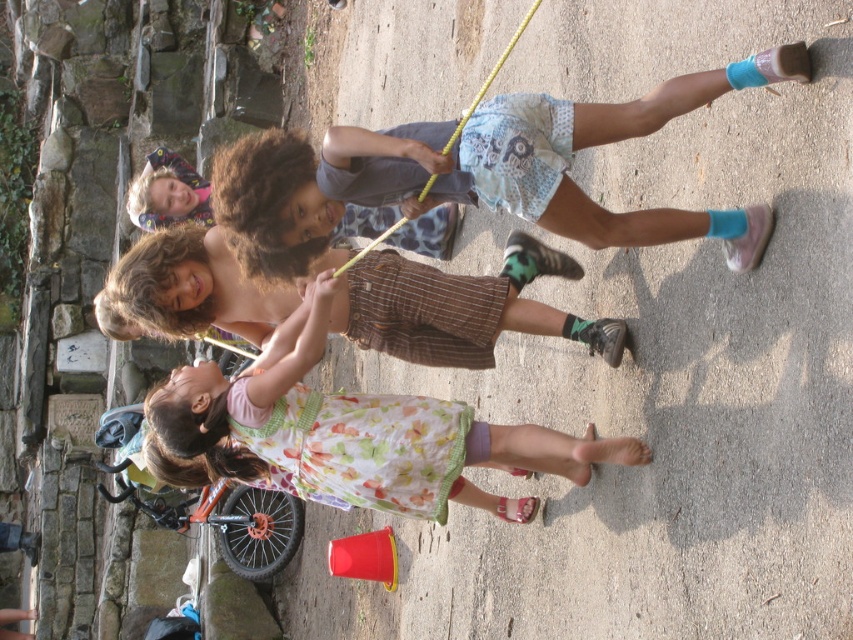
Between brown plaid shorts at center and blonde hair at upper left, which one is positioned lower?

brown plaid shorts at center is lower down.

Which is behind, point (409, 344) or point (149, 173)?

The point (149, 173) is more distant.

Where is `brown plaid shorts at center`? The height and width of the screenshot is (640, 853). brown plaid shorts at center is located at coordinates (462, 308).

Which is more to the right, light blue printed shorts at upper right or yellow rubber rope at center?

From the viewer's perspective, yellow rubber rope at center appears more on the right side.

Does light blue printed shorts at upper right come behind yellow rubber rope at center?

No.

Which is behind, point (236, 204) or point (401, 218)?

Positioned behind is point (401, 218).

At what (x,y) coordinates should I click in order to perform the action: click on light blue printed shorts at upper right. Please return your answer as a coordinate pair (x, y). Looking at the image, I should click on (479, 172).

Can you confirm if floral cotton dress at center is positioned below brown plaid shorts at center?

Yes.

Where is `floral cotton dress at center`? floral cotton dress at center is located at coordinates (352, 433).

You are a GUI agent. You are given a task and a screenshot of the screen. Output one action in this format:
    pyautogui.click(x=<x>, y=<y>)
    Task: Click on the floral cotton dress at center
    This screenshot has height=640, width=853.
    Given the screenshot: What is the action you would take?
    pyautogui.click(x=352, y=433)